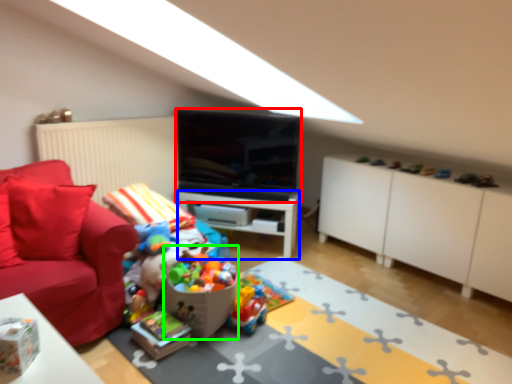
Question: Estimate the real-world distances between objects in this image. Which object is farther from television (highlighted by a red box), table (highlighted by a blue box) or toy (highlighted by a green box)?

Choices:
 (A) table
 (B) toy

Answer: (B)